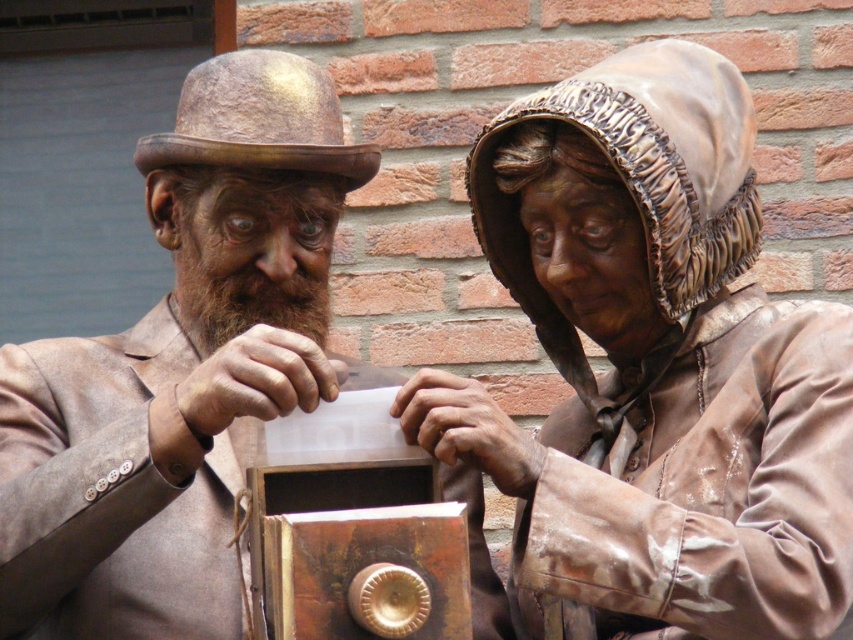
You are a GUI agent. You are given a task and a screenshot of the screen. Output one action in this format:
    pyautogui.click(x=<x>, y=<y>)
    Task: Click on the bronze statue at center
    The image size is (853, 640).
    Given the screenshot: What is the action you would take?
    pyautogui.click(x=650, y=371)

Identify the location of bronze statue at center. (650, 371).